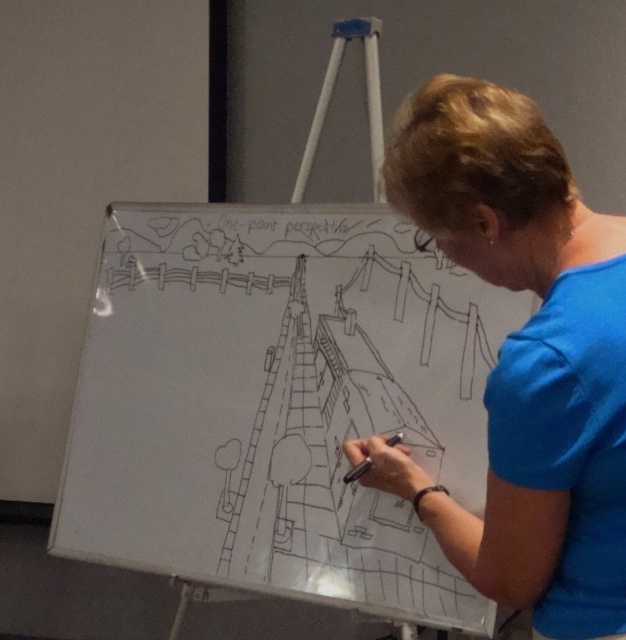
Question: Among these objects, which one is farthest from the camera?

Choices:
 (A) white paperboard at center
 (B) black matte pen at center
 (C) black line drawing eiffel tower at center

Answer: (C)

Question: Does white paperboard at center have a lesser width compared to black line drawing eiffel tower at center?

Choices:
 (A) no
 (B) yes

Answer: (A)

Question: Can you confirm if white paperboard at center is thinner than black matte pen at center?

Choices:
 (A) no
 (B) yes

Answer: (A)

Question: Which of the following is the closest to the observer?

Choices:
 (A) black matte pen at center
 (B) blue fabric shirt at center
 (C) black line drawing eiffel tower at center
 (D) white paperboard at center

Answer: (B)

Question: Is black line drawing eiffel tower at center wider than black matte pen at center?

Choices:
 (A) yes
 (B) no

Answer: (A)

Question: Which of the following is the closest to the observer?

Choices:
 (A) (302, 205)
 (B) (217, 456)
 (C) (344, 481)

Answer: (C)